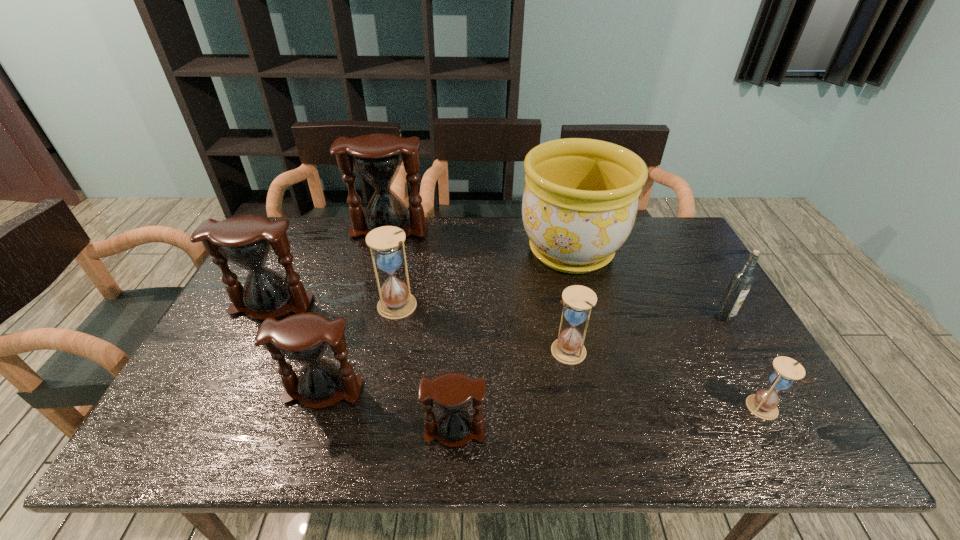
You are a GUI agent. You are given a task and a screenshot of the screen. Output one action in this format:
    pyautogui.click(x=<x>, y=<y>)
    Task: Click on the free space between the second nearest brown hourglass and the leftmost white hourglass
    
    Given the screenshot: What is the action you would take?
    pyautogui.click(x=360, y=348)

In order to click on vacant point located between the farthest brown hourglass and the smallest brown hourglass in this screenshot , I will do `click(422, 330)`.

The image size is (960, 540). I want to click on empty space between the biggest brown hourglass and the fifth hourglass from left to right, so click(422, 330).

Locate which object ranks second in proximity to the third biggest brown hourglass. Please provide its 2D coordinates. Your answer should be formatted as a tuple, i.e. [(x, y)], where the tuple contains the x and y coordinates of a point satisfying the conditions above.

[(246, 241)]

Identify which object is located as the seventh nearest to the second white hourglass from right to left. Please provide its 2D coordinates. Your answer should be formatted as a tuple, i.e. [(x, y)], where the tuple contains the x and y coordinates of a point satisfying the conditions above.

[(377, 157)]

Image resolution: width=960 pixels, height=540 pixels. What are the coordinates of `the third closest hourglass to the second farthest brown hourglass` in the screenshot? It's located at (377, 157).

Choose which hourglass is the second nearest neighbor to the third farthest brown hourglass. Please provide its 2D coordinates. Your answer should be formatted as a tuple, i.e. [(x, y)], where the tuple contains the x and y coordinates of a point satisfying the conditions above.

[(246, 241)]

Find the location of a particular element. brown hourglass that stands as the second closest to the smallest brown hourglass is located at coordinates point(246,241).

This screenshot has height=540, width=960. Find the location of `the third closest brown hourglass to the nearest white hourglass`. the third closest brown hourglass to the nearest white hourglass is located at coordinates (377, 157).

In order to click on white hourglass that is the nearest to the third biggest brown hourglass in this screenshot , I will do `click(396, 302)`.